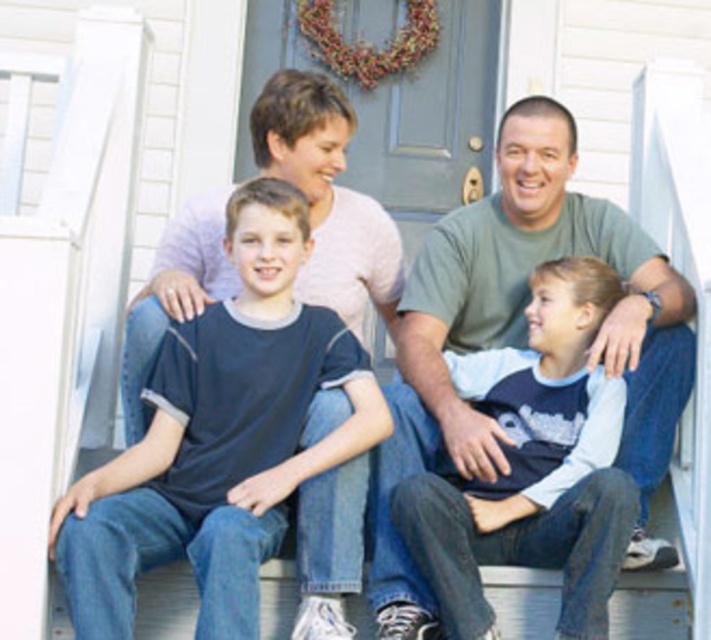
Can you confirm if dark blue t-shirt at center is wider than green matte shirt at center?

No.

Between dark blue t-shirt at center and green matte shirt at center, which one appears on the right side from the viewer's perspective?

green matte shirt at center

Describe the element at coordinates (219, 436) in the screenshot. This screenshot has width=711, height=640. I see `dark blue t-shirt at center` at that location.

This screenshot has height=640, width=711. Find the location of `dark blue t-shirt at center`. dark blue t-shirt at center is located at coordinates [x=219, y=436].

The height and width of the screenshot is (640, 711). What do you see at coordinates (528, 298) in the screenshot?
I see `green matte shirt at center` at bounding box center [528, 298].

Between point (665, 340) and point (589, 513), which one is positioned in front?

Point (589, 513)

Where is `green matte shirt at center`? This screenshot has height=640, width=711. green matte shirt at center is located at coordinates (528, 298).

Is point (250, 225) farther from viewer compared to point (456, 500)?

Yes.

What do you see at coordinates (219, 436) in the screenshot?
I see `dark blue t-shirt at center` at bounding box center [219, 436].

Identify the location of dark blue t-shirt at center. This screenshot has width=711, height=640. (219, 436).